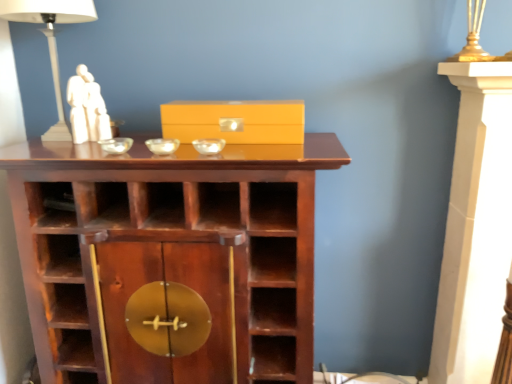
Question: Is transparent glass bowl at center, the third glass bowl in the left-to-right sequence, oriented towards clear glass bowl at center, the 1th glass bowl positioned from the left?

Choices:
 (A) yes
 (B) no

Answer: (B)

Question: Is transparent glass bowl at center, positioned as the first glass bowl in right-to-left order, not close to clear glass bowl at center, the 1th glass bowl positioned from the left?

Choices:
 (A) no
 (B) yes

Answer: (A)

Question: Is transparent glass bowl at center, the third glass bowl in the left-to-right sequence, not within clear glass bowl at center, acting as the third glass bowl starting from the right?

Choices:
 (A) yes
 (B) no

Answer: (A)

Question: From the image's perspective, does transparent glass bowl at center, positioned as the first glass bowl in right-to-left order, appear lower than clear glass bowl at center, the 1th glass bowl positioned from the left?

Choices:
 (A) yes
 (B) no

Answer: (A)

Question: Is the surface of transparent glass bowl at center, positioned as the first glass bowl in right-to-left order, in direct contact with clear glass bowl at center, the 1th glass bowl positioned from the left?

Choices:
 (A) yes
 (B) no

Answer: (B)

Question: From a real-world perspective, is transparent glass bowl at center, positioned as the first glass bowl in right-to-left order, below clear glass bowl at center, the 1th glass bowl positioned from the left?

Choices:
 (A) yes
 (B) no

Answer: (B)

Question: Does transparent glass bowl at center, which appears as the second glass bowl when viewed from the left, have a lesser height compared to white marble statue at upper left?

Choices:
 (A) yes
 (B) no

Answer: (A)

Question: Does transparent glass bowl at center, which appears as the second glass bowl when viewed from the left, have a greater height compared to white marble statue at upper left?

Choices:
 (A) no
 (B) yes

Answer: (A)

Question: From the image's perspective, would you say transparent glass bowl at center, which appears as the second glass bowl when viewed from the left, is positioned over white marble statue at upper left?

Choices:
 (A) no
 (B) yes

Answer: (A)

Question: Can you confirm if transparent glass bowl at center, which is the 2th glass bowl in right-to-left order, is thinner than white marble statue at upper left?

Choices:
 (A) yes
 (B) no

Answer: (A)

Question: Does transparent glass bowl at center, which appears as the second glass bowl when viewed from the left, lie behind white marble statue at upper left?

Choices:
 (A) no
 (B) yes

Answer: (A)

Question: Is transparent glass bowl at center, which appears as the second glass bowl when viewed from the left, placed right next to white marble statue at upper left?

Choices:
 (A) yes
 (B) no

Answer: (B)

Question: Is transparent glass bowl at center, which is the 2th glass bowl in right-to-left order, to the right of matte yellow box at center from the viewer's perspective?

Choices:
 (A) no
 (B) yes

Answer: (A)